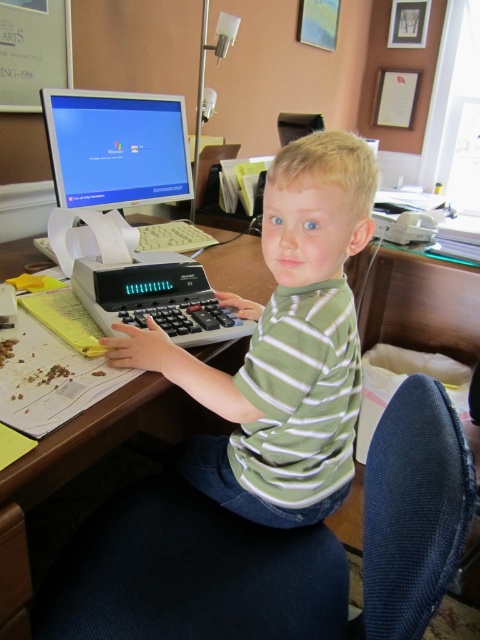
Question: Which point is farther to the camera?

Choices:
 (A) matte plastic monitor at upper left
 (B) gray plastic calculator at lower left

Answer: (A)

Question: Which point is closer to the camera?

Choices:
 (A) (251, 285)
 (B) (187, 317)

Answer: (B)

Question: Is green striped shirt at center closer to camera compared to matte plastic monitor at upper left?

Choices:
 (A) yes
 (B) no

Answer: (A)

Question: Where is wooden table at center located in relation to gray plastic calculator at lower left in the image?

Choices:
 (A) above
 (B) below

Answer: (B)

Question: Does matte plastic monitor at upper left have a larger size compared to gray plastic calculator at lower left?

Choices:
 (A) yes
 (B) no

Answer: (A)

Question: Estimate the real-world distances between objects in this image. Which object is closer to the matte plastic monitor at upper left?

Choices:
 (A) gray plastic calculator at lower left
 (B) green striped shirt at center

Answer: (A)